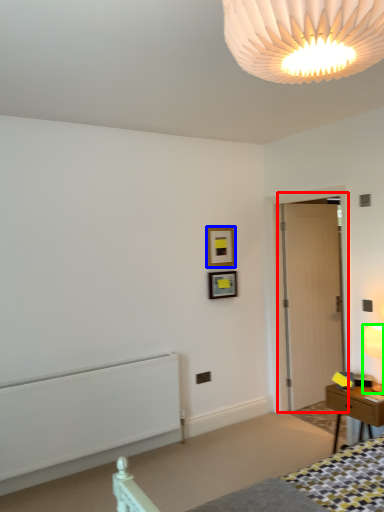
Question: Based on their relative distances, which object is nearer to door (highlighted by a red box)? Choose from picture frame (highlighted by a blue box) and lamp (highlighted by a green box).

Choices:
 (A) picture frame
 (B) lamp

Answer: (A)